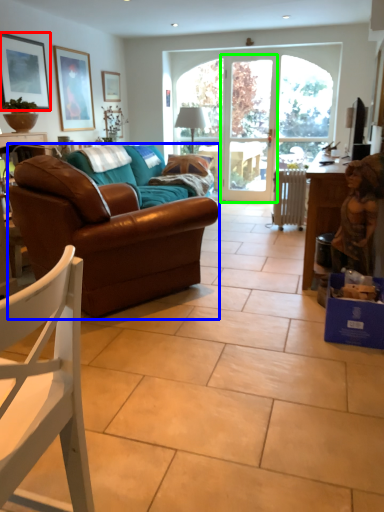
Question: Which is nearer to the picture frame (highlighted by a red box)? studio couch (highlighted by a blue box) or screen door (highlighted by a green box).

Choices:
 (A) studio couch
 (B) screen door

Answer: (A)